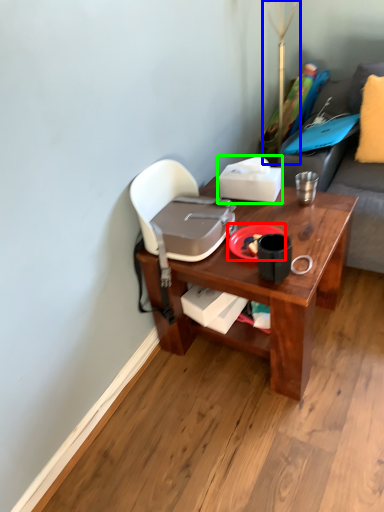
Question: Which is nearer to the plate (highlighted by a red box)? table lamp (highlighted by a blue box) or box (highlighted by a green box).

Choices:
 (A) table lamp
 (B) box

Answer: (B)